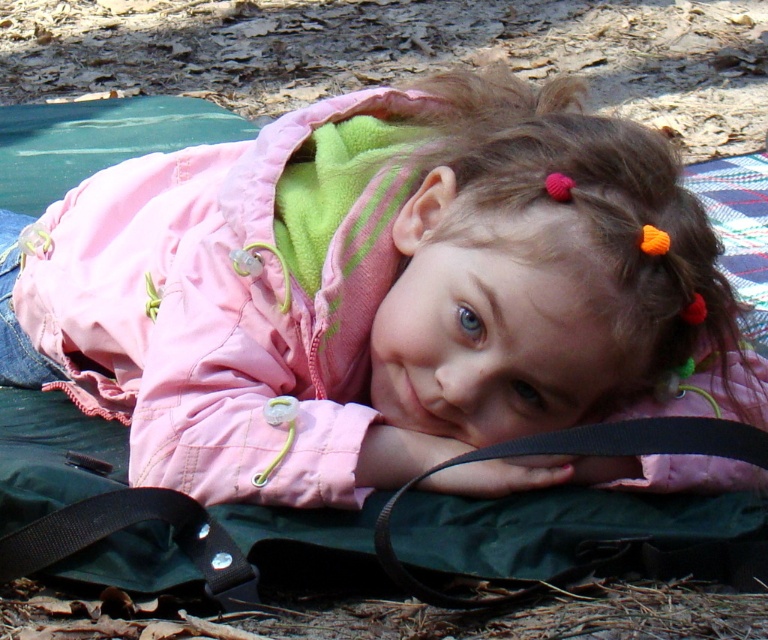
Question: Is pink fabric jacket at center above black fabric strap at lower left?

Choices:
 (A) yes
 (B) no

Answer: (A)

Question: Does pink fabric jacket at center have a larger size compared to black fabric strap at lower left?

Choices:
 (A) yes
 (B) no

Answer: (A)

Question: Which of the following is the farthest from the observer?

Choices:
 (A) (229, 547)
 (B) (267, 164)

Answer: (B)

Question: Considering the relative positions of pink fabric jacket at center and black fabric strap at lower left in the image provided, where is pink fabric jacket at center located with respect to black fabric strap at lower left?

Choices:
 (A) below
 (B) above

Answer: (B)